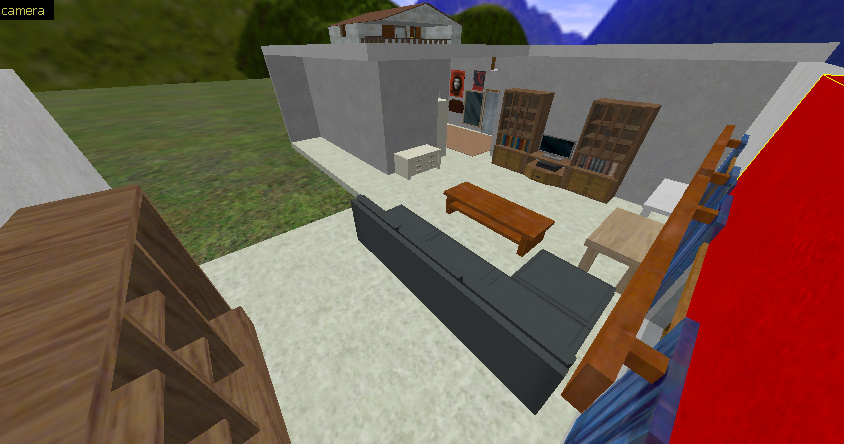
Where is `drawer`? The height and width of the screenshot is (444, 844). drawer is located at coordinates (423, 158).